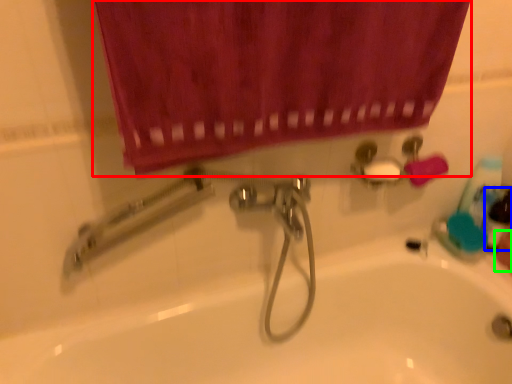
Question: Which is nearer to the curtain (highlighted by a red box)? mouthwash (highlighted by a blue box) or hand (highlighted by a green box).

Choices:
 (A) mouthwash
 (B) hand

Answer: (A)